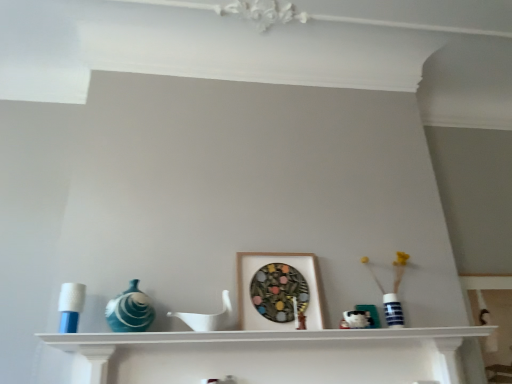
Question: Is matte blue glass vase at left smaller than white matte shelf at center?

Choices:
 (A) no
 (B) yes

Answer: (B)

Question: Is matte blue glass vase at left positioned with its back to white matte shelf at center?

Choices:
 (A) yes
 (B) no

Answer: (B)

Question: Can you confirm if matte blue glass vase at left is positioned to the left of white matte shelf at center?

Choices:
 (A) yes
 (B) no

Answer: (A)

Question: From a real-world perspective, is matte blue glass vase at left on white matte shelf at center?

Choices:
 (A) yes
 (B) no

Answer: (A)

Question: Considering the relative sizes of matte blue glass vase at left and white matte shelf at center in the image provided, is matte blue glass vase at left thinner than white matte shelf at center?

Choices:
 (A) yes
 (B) no

Answer: (A)

Question: Can you confirm if matte blue glass vase at left is shorter than white matte shelf at center?

Choices:
 (A) yes
 (B) no

Answer: (B)

Question: Can you confirm if white matte shelf at center is wider than blue striped vase at right?

Choices:
 (A) no
 (B) yes

Answer: (B)

Question: From the image's perspective, does white matte shelf at center appear lower than blue striped vase at right?

Choices:
 (A) yes
 (B) no

Answer: (A)

Question: Is white matte shelf at center facing towards blue striped vase at right?

Choices:
 (A) yes
 (B) no

Answer: (B)

Question: Can blue striped vase at right be found inside white matte shelf at center?

Choices:
 (A) no
 (B) yes

Answer: (A)

Question: Can you confirm if white matte shelf at center is shorter than blue striped vase at right?

Choices:
 (A) no
 (B) yes

Answer: (B)

Question: Is white matte shelf at center looking in the opposite direction of blue striped vase at right?

Choices:
 (A) yes
 (B) no

Answer: (B)

Question: Is white matte shelf at center looking in the opposite direction of wooden picture frame at center?

Choices:
 (A) yes
 (B) no

Answer: (B)